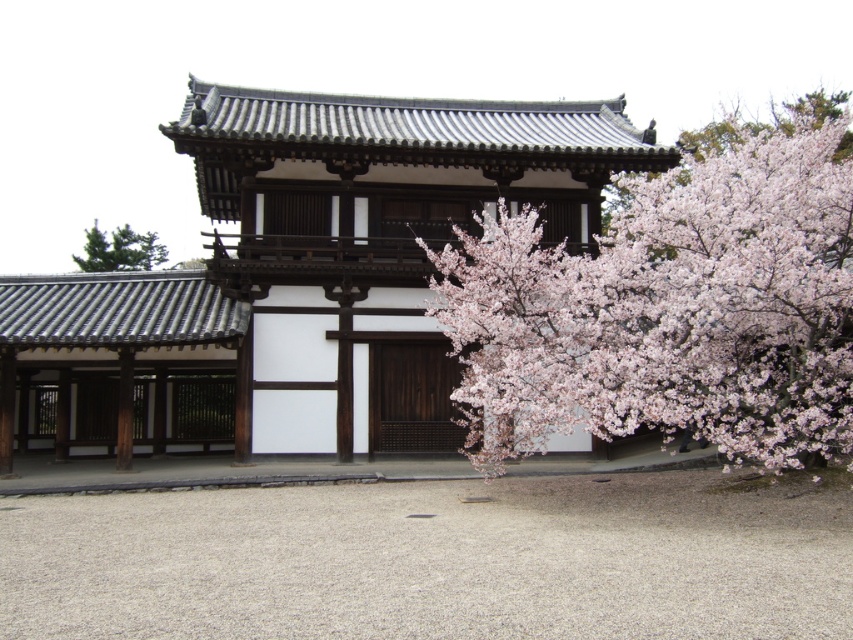
You are standing at the entrance of the white wood building at center. From your current position, which direction would you face to look towards the gravel pathway leading up to the building?

Since the gravel pathway leads up to the white wood building at center, you would face away from the entrance towards the pathway. However, based on the scene description, the pathway is in the foreground leading to the building, so if you are at the entrance facing outward, the pathway would be behind you. To look towards the pathway, you would need to turn around and face the direction opposite the building entrance.

You are standing at the gravel pathway leading to the white wood building at center. You want to reach the entrance within 10 seconds. If your walking speed is 3 feet per second, will you be able to reach the entrance in time?

The distance to the white wood building at center is 55.07 feet. At a walking speed of 3 feet per second, it would take approximately 18.36 seconds to reach the entrance. Therefore, you will not be able to reach the entrance within 10 seconds.